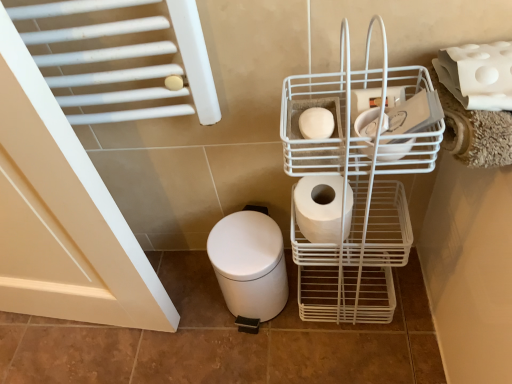
At what (x,y) coordinates should I click in order to perform the action: click on vacant region to the right of white wire basket at center right. Please return your answer as a coordinate pair (x, y). The image size is (512, 384). Looking at the image, I should click on (410, 303).